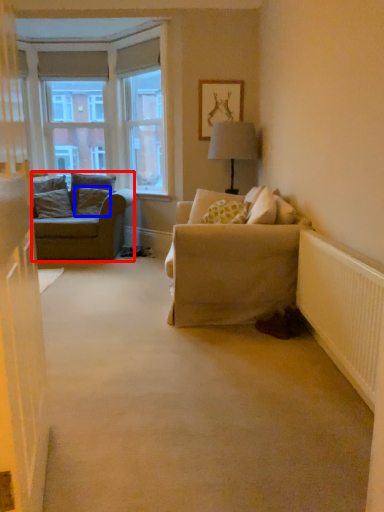
Question: Which object appears farthest to the camera in this image, studio couch (highlighted by a red box) or pillow (highlighted by a blue box)?

Choices:
 (A) studio couch
 (B) pillow

Answer: (B)